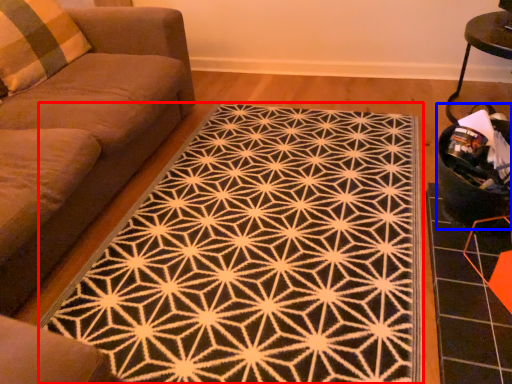
Question: Which object is closer to the camera taking this photo, mat (highlighted by a red box) or swivel chair (highlighted by a blue box)?

Choices:
 (A) mat
 (B) swivel chair

Answer: (A)